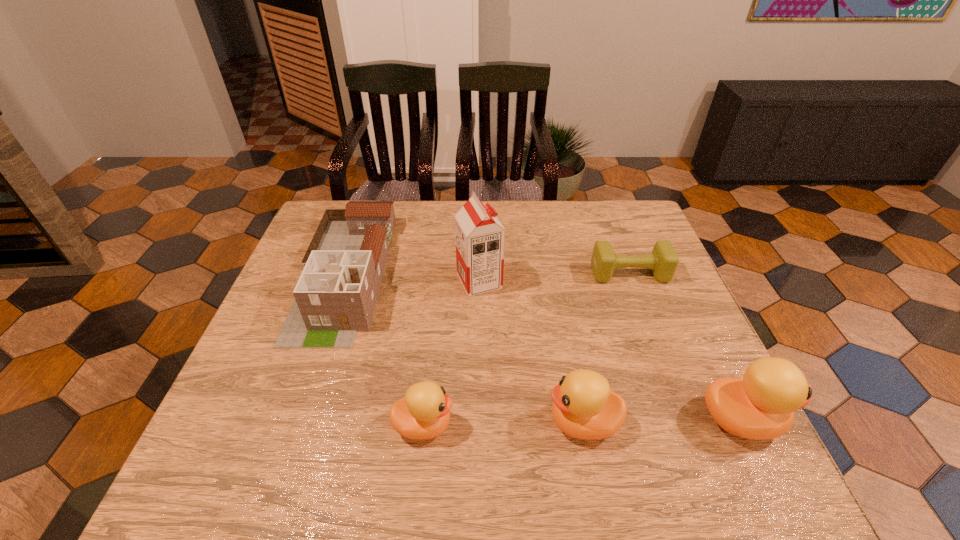
This screenshot has width=960, height=540. I want to click on vacant area that lies between the third object from right to left and the soya milk, so click(x=531, y=352).

Find the location of a particular element. The height and width of the screenshot is (540, 960). vacant area between the rightmost duckling and the second duckling from left to right is located at coordinates (661, 421).

Find the location of a particular element. Image resolution: width=960 pixels, height=540 pixels. free spot between the dollhouse and the second duckling from left to right is located at coordinates (464, 349).

Locate an element on the screen. free space between the shortest duckling and the dollhouse is located at coordinates (384, 350).

Where is `empty location between the second shortest object and the soya milk`? The height and width of the screenshot is (540, 960). empty location between the second shortest object and the soya milk is located at coordinates (451, 353).

What are the coordinates of `the fifth closest object to the second duckling from right to left` in the screenshot? It's located at (335, 297).

Select which object appears as the second closest to the soya milk. Please provide its 2D coordinates. Your answer should be formatted as a tuple, i.e. [(x, y)], where the tuple contains the x and y coordinates of a point satisfying the conditions above.

[(663, 261)]

You are a GUI agent. You are given a task and a screenshot of the screen. Output one action in this format:
    pyautogui.click(x=<x>, y=<y>)
    Task: Click on the duckling object that ranks as the third closest to the dumbbell
    This screenshot has width=960, height=540.
    Given the screenshot: What is the action you would take?
    pyautogui.click(x=423, y=413)

Identify which duckling is the third nearest to the tallest object. Please provide its 2D coordinates. Your answer should be formatted as a tuple, i.e. [(x, y)], where the tuple contains the x and y coordinates of a point satisfying the conditions above.

[(761, 405)]

The height and width of the screenshot is (540, 960). Identify the location of vacant region that satisfies the following two spatial constraints: 1. on the back side of the tallest object; 2. on the left side of the shortest object. (479, 274).